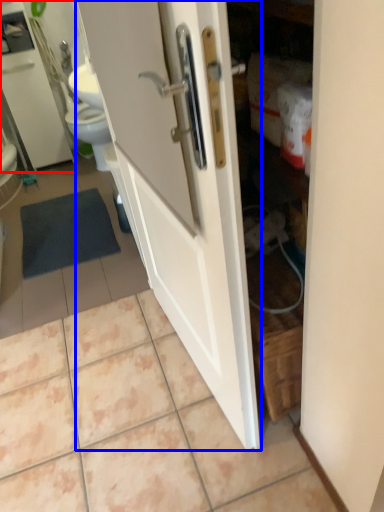
Question: Among these objects, which one is nearest to the camera, medicine cabinet (highlighted by a red box) or door (highlighted by a blue box)?

Choices:
 (A) medicine cabinet
 (B) door

Answer: (B)